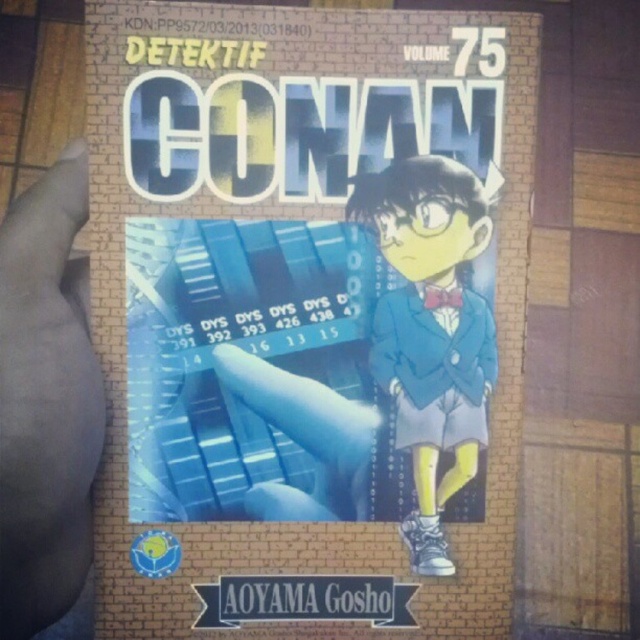
Looking at the manga cover for Detektif Conan Volume 75, you notice two elements on the cover. One is the dark skin at left and the matte blue suit at center. Based on their positions, which one appears closer to the viewer?

The dark skin at left is in front of the matte blue suit at center, so it appears closer to the viewer.

You are looking at the manga cover for Detektif Conan Volume 75. There are two points on the cover located at coordinates point (506, 330) and point (460, 349). Which point is closer to you?

Point (506, 330) is further to the camera than point (460, 349), so point (460, 349) is closer to you.

You are a detective trying to analyze the manga cover for clues. You notice two elements on the cover that might be important. The first is the dark skin at left and the second is the matte blue suit at center. Based on the spatial relationship between these two elements, can you determine if they are positioned close enough to suggest they belong to the same character or are part of a single scene?

The dark skin at left is 4.54 inches away from the matte blue suit at center. Given this distance, they are likely part of the same scene but belong to different characters since the separation suggests distinct positioning.